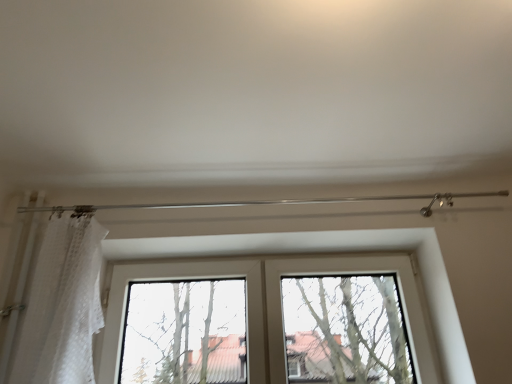
Question: Considering the relative positions of bare branches at center and white lace curtain at left in the image provided, is bare branches at center to the right of white lace curtain at left from the viewer's perspective?

Choices:
 (A) no
 (B) yes

Answer: (B)

Question: Is bare branches at center surrounding white lace curtain at left?

Choices:
 (A) yes
 (B) no

Answer: (B)

Question: Does bare branches at center come behind white lace curtain at left?

Choices:
 (A) no
 (B) yes

Answer: (B)

Question: Does bare branches at center have a lesser width compared to white lace curtain at left?

Choices:
 (A) no
 (B) yes

Answer: (B)

Question: Considering the relative sizes of bare branches at center and white lace curtain at left in the image provided, is bare branches at center bigger than white lace curtain at left?

Choices:
 (A) no
 (B) yes

Answer: (B)

Question: Is point (202, 382) closer or farther from the camera than point (386, 314)?

Choices:
 (A) closer
 (B) farther

Answer: (A)

Question: From the image's perspective, is clear glass window at center above or below bare branches at center?

Choices:
 (A) below
 (B) above

Answer: (A)

Question: Looking at the image, does clear glass window at center seem bigger or smaller compared to bare branches at center?

Choices:
 (A) small
 (B) big

Answer: (B)

Question: Is clear glass window at center in front of or behind bare branches at center in the image?

Choices:
 (A) behind
 (B) front

Answer: (B)

Question: Does point (81, 334) appear closer or farther from the camera than point (180, 314)?

Choices:
 (A) farther
 (B) closer

Answer: (B)

Question: In terms of height, does white lace curtain at left look taller or shorter compared to clear glass window at center?

Choices:
 (A) short
 (B) tall

Answer: (B)

Question: Based on their sizes in the image, would you say white lace curtain at left is bigger or smaller than clear glass window at center?

Choices:
 (A) small
 (B) big

Answer: (A)

Question: Is white lace curtain at left situated inside clear glass window at center or outside?

Choices:
 (A) outside
 (B) inside

Answer: (A)

Question: Which is correct: bare branches at center is inside white lace curtain at left, or outside of it?

Choices:
 (A) inside
 (B) outside

Answer: (B)

Question: In terms of width, does bare branches at center look wider or thinner when compared to white lace curtain at left?

Choices:
 (A) thin
 (B) wide

Answer: (A)